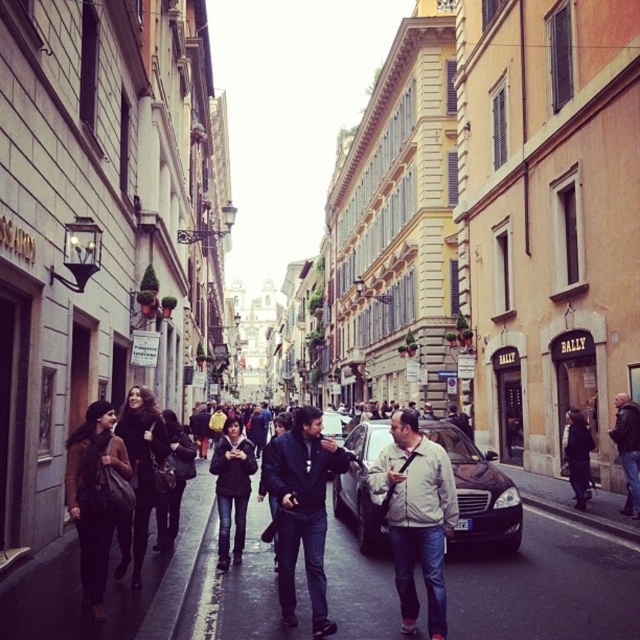
Measure the distance from brown leather jacket at lower left to dark gray coat at center.

A distance of 46.62 meters exists between brown leather jacket at lower left and dark gray coat at center.

Between brown leather jacket at lower left and dark gray coat at center, which one has less height?

With less height is dark gray coat at center.

Between point (84, 500) and point (582, 500), which one is positioned behind?

Positioned behind is point (582, 500).

Where is `brown leather jacket at lower left`? brown leather jacket at lower left is located at coordinates (93, 497).

Is smooth asphalt pavement at center wider than dark gray jacket at right?

Indeed, smooth asphalt pavement at center has a greater width compared to dark gray jacket at right.

Can you confirm if smooth asphalt pavement at center is smaller than dark gray jacket at right?

No, smooth asphalt pavement at center is not smaller than dark gray jacket at right.

The height and width of the screenshot is (640, 640). I want to click on smooth asphalt pavement at center, so click(x=545, y=586).

Locate an element on the screen. The width and height of the screenshot is (640, 640). smooth asphalt pavement at center is located at coordinates [545, 586].

In the scene shown: Who is more forward, (502, 554) or (93, 444)?

Point (93, 444)

You are a GUI agent. You are given a task and a screenshot of the screen. Output one action in this format:
    pyautogui.click(x=<x>, y=<y>)
    Task: Click on the smooth asphalt pavement at center
    The width and height of the screenshot is (640, 640).
    Given the screenshot: What is the action you would take?
    pyautogui.click(x=545, y=586)